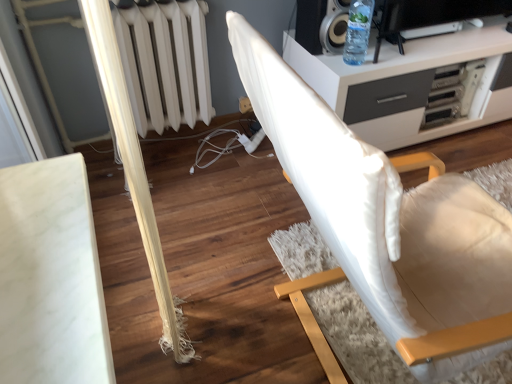
You are a GUI agent. You are given a task and a screenshot of the screen. Output one action in this format:
    pyautogui.click(x=<x>, y=<y>)
    Task: Click on the white fabric chair at center
    The image size is (512, 384).
    Given the screenshot: What is the action you would take?
    pyautogui.click(x=381, y=208)

Image resolution: width=512 pixels, height=384 pixels. Describe the element at coordinates (381, 208) in the screenshot. I see `white fabric chair at center` at that location.

This screenshot has width=512, height=384. Find the location of `clear plastic bottle at upper right`. clear plastic bottle at upper right is located at coordinates (358, 31).

Describe the element at coordinates (358, 31) in the screenshot. The height and width of the screenshot is (384, 512). I see `clear plastic bottle at upper right` at that location.

The height and width of the screenshot is (384, 512). I want to click on white fabric chair at center, so click(x=381, y=208).

Is clear plastic bottle at upper right to the left of white fabric chair at center from the viewer's perspective?

No, clear plastic bottle at upper right is not to the left of white fabric chair at center.

Is clear plastic bottle at upper right in front of white fabric chair at center?

No, the depth of clear plastic bottle at upper right is greater than that of white fabric chair at center.

Which is less distant, (359,16) or (418,324)?

The point (418,324) is closer.

From the image's perspective, is clear plastic bottle at upper right above white fabric chair at center?

Yes, from the image's perspective, clear plastic bottle at upper right is above white fabric chair at center.

From a real-world perspective, is clear plastic bottle at upper right under white fabric chair at center?

No, from a real-world perspective, clear plastic bottle at upper right is not beneath white fabric chair at center.

Which of these two, clear plastic bottle at upper right or white fabric chair at center, is thinner?

clear plastic bottle at upper right.

Considering the sizes of clear plastic bottle at upper right and white fabric chair at center in the image, is clear plastic bottle at upper right taller or shorter than white fabric chair at center?

In the image, clear plastic bottle at upper right appears to be shorter than white fabric chair at center.

Is clear plastic bottle at upper right bigger than white fabric chair at center?

Incorrect, clear plastic bottle at upper right is not larger than white fabric chair at center.

Is white fabric chair at center completely or partially inside clear plastic bottle at upper right?

No, clear plastic bottle at upper right does not contain white fabric chair at center.

Is clear plastic bottle at upper right touching white fabric chair at center?

No, clear plastic bottle at upper right is not next to white fabric chair at center.

Is clear plastic bottle at upper right looking in the opposite direction of white fabric chair at center?

clear plastic bottle at upper right is not turned away from white fabric chair at center.

How many degrees apart are the facing directions of clear plastic bottle at upper right and white fabric chair at center?

The angle between the facing direction of clear plastic bottle at upper right and the facing direction of white fabric chair at center is 86.5 degrees.

Identify the location of chair that is in front of the clear plastic bottle at upper right. (381, 208).

Between white fabric chair at center and clear plastic bottle at upper right, which one appears on the left side from the viewer's perspective?

white fabric chair at center is more to the left.

Is white fabric chair at center in front of or behind clear plastic bottle at upper right in the image?

Clearly, white fabric chair at center is in front of clear plastic bottle at upper right.

Is point (425, 184) closer to viewer compared to point (370, 17)?

That is True.

In the scene shown: From the image's perspective, which one is positioned lower, white fabric chair at center or clear plastic bottle at upper right?

white fabric chair at center appears lower in the image.

From a real-world perspective, between white fabric chair at center and clear plastic bottle at upper right, who is vertically higher?

In real-world perspective, clear plastic bottle at upper right is above.

Between white fabric chair at center and clear plastic bottle at upper right, which one has larger width?

Wider between the two is white fabric chair at center.

Is white fabric chair at center shorter than clear plastic bottle at upper right?

No.

Does white fabric chair at center have a smaller size compared to clear plastic bottle at upper right?

Actually, white fabric chair at center might be larger than clear plastic bottle at upper right.

Is white fabric chair at center inside or outside of clear plastic bottle at upper right?

white fabric chair at center is spatially situated outside clear plastic bottle at upper right.

Is white fabric chair at center not near clear plastic bottle at upper right?

Actually, white fabric chair at center and clear plastic bottle at upper right are a little close together.

Is clear plastic bottle at upper right at the back of white fabric chair at center?

No, white fabric chair at center is not facing the opposite direction of clear plastic bottle at upper right.

Can you tell me how much white fabric chair at center and clear plastic bottle at upper right differ in facing direction?

86.5 degrees.

Find the location of a particular element. bottle lying on the right of white fabric chair at center is located at coordinates (358, 31).

I want to click on chair located underneath the clear plastic bottle at upper right (from a real-world perspective), so click(x=381, y=208).

Locate an element on the screen. bottle that is above the white fabric chair at center (from the image's perspective) is located at coordinates (358, 31).